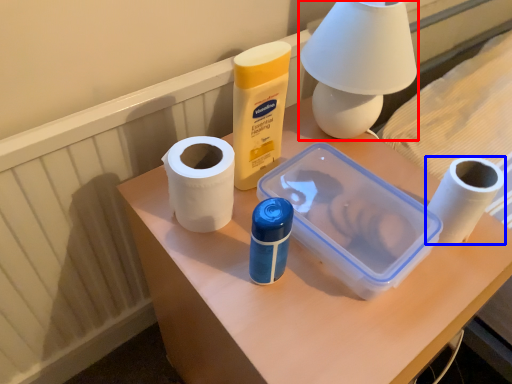
Question: Which object is further to the camera taking this photo, table lamp (highlighted by a red box) or toilet paper (highlighted by a blue box)?

Choices:
 (A) table lamp
 (B) toilet paper

Answer: (B)